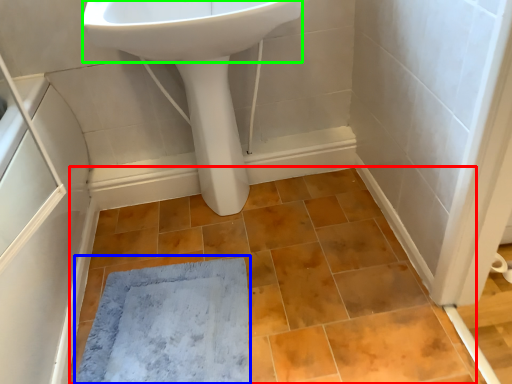
Question: Estimate the real-world distances between objects in this image. Which object is farther from ceramic tile (highlighted by a red box), bath mat (highlighted by a blue box) or sink (highlighted by a green box)?

Choices:
 (A) bath mat
 (B) sink

Answer: (B)